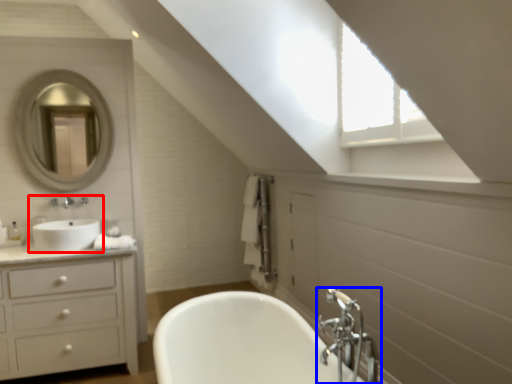
Question: Which object appears farthest to the camera in this image, sink (highlighted by a red box) or tap (highlighted by a blue box)?

Choices:
 (A) sink
 (B) tap

Answer: (A)